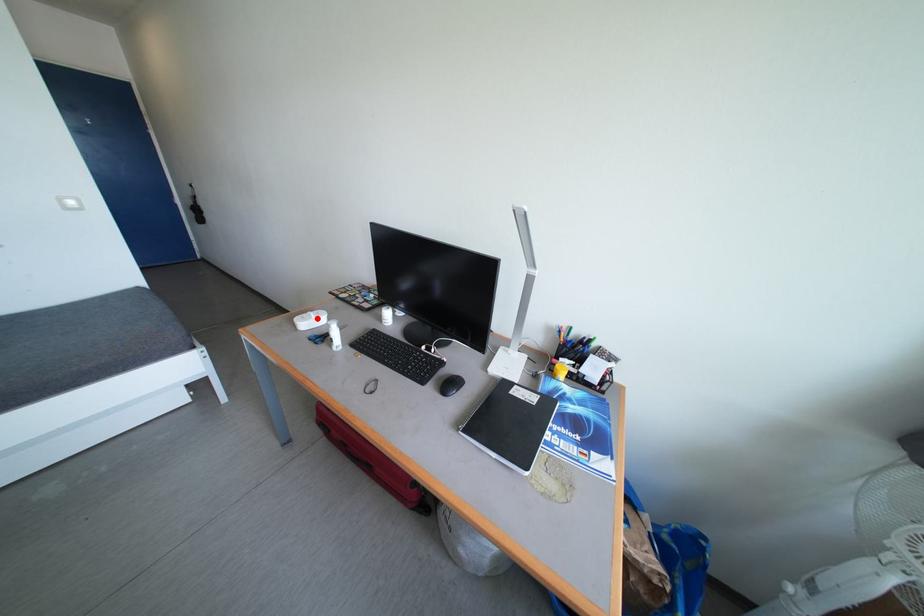
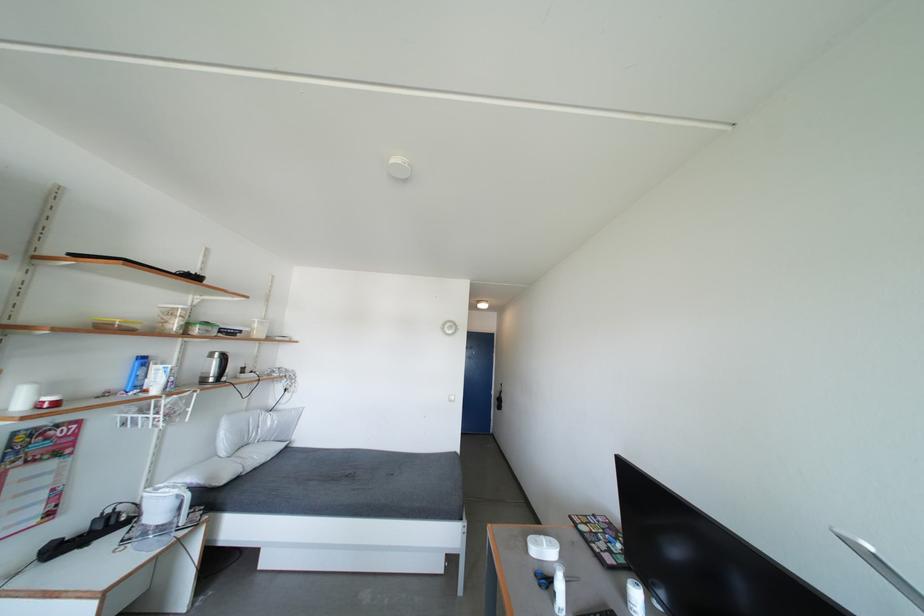
The point at the highlighted location is marked in the first image. Where is the corresponding point in the second image?

(550, 544)